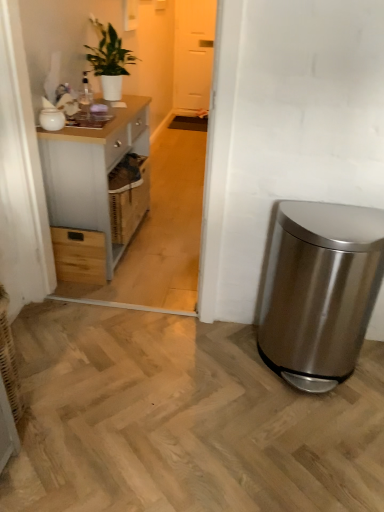
Locate an element on the screen. The width and height of the screenshot is (384, 512). vacant area on top of light gray wood cabinet at left (from a real-world perspective) is located at coordinates (101, 111).